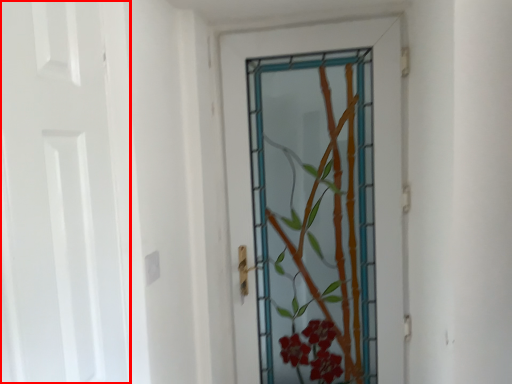
Question: From the image's perspective, where is door (annotated by the red box) located relative to door?

Choices:
 (A) below
 (B) above

Answer: (B)